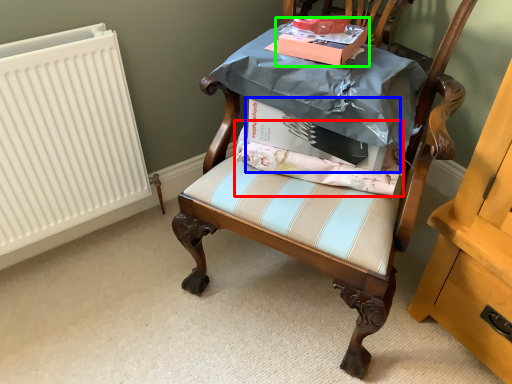
Question: Which is nearer to the fabric (highlighted by a red box)? cardboard box (highlighted by a blue box) or cardboard box (highlighted by a green box).

Choices:
 (A) cardboard box
 (B) cardboard box

Answer: (A)